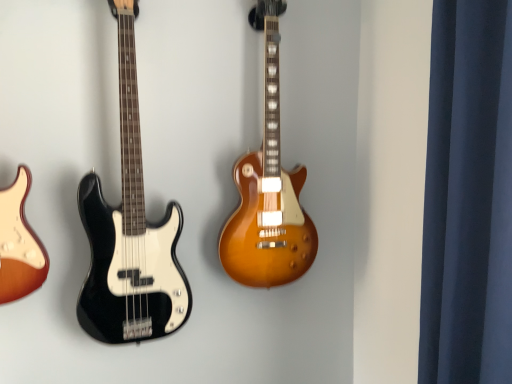
Question: Considering the relative positions of satin sunburst guitar at center, which appears as the 2th guitar when viewed from the left, and dark blue fabric at right in the image provided, is satin sunburst guitar at center, which appears as the 2th guitar when viewed from the left, to the left of dark blue fabric at right from the viewer's perspective?

Choices:
 (A) yes
 (B) no

Answer: (A)

Question: Considering the relative positions of satin sunburst guitar at center, which appears as the 2th guitar when viewed from the left, and dark blue fabric at right in the image provided, is satin sunburst guitar at center, which appears as the 2th guitar when viewed from the left, to the right of dark blue fabric at right from the viewer's perspective?

Choices:
 (A) no
 (B) yes

Answer: (A)

Question: Considering the relative sizes of satin sunburst guitar at center, which is counted as the 1th guitar, starting from the right, and dark blue fabric at right in the image provided, is satin sunburst guitar at center, which is counted as the 1th guitar, starting from the right, thinner than dark blue fabric at right?

Choices:
 (A) no
 (B) yes

Answer: (B)

Question: Considering the relative sizes of satin sunburst guitar at center, which is counted as the 1th guitar, starting from the right, and dark blue fabric at right in the image provided, is satin sunburst guitar at center, which is counted as the 1th guitar, starting from the right, taller than dark blue fabric at right?

Choices:
 (A) yes
 (B) no

Answer: (A)

Question: Is satin sunburst guitar at center, which is counted as the 1th guitar, starting from the right, positioned with its back to dark blue fabric at right?

Choices:
 (A) no
 (B) yes

Answer: (A)

Question: Is satin sunburst guitar at center, which is counted as the 1th guitar, starting from the right, positioned behind dark blue fabric at right?

Choices:
 (A) no
 (B) yes

Answer: (B)

Question: Does satin sunburst guitar at center, which is counted as the 1th guitar, starting from the right, touch black glossy bass guitar at left, which is the 1th guitar from left to right?

Choices:
 (A) yes
 (B) no

Answer: (B)

Question: Is satin sunburst guitar at center, which is counted as the 1th guitar, starting from the right, taller than black glossy bass guitar at left, which is the 1th guitar from left to right?

Choices:
 (A) no
 (B) yes

Answer: (A)

Question: From a real-world perspective, is satin sunburst guitar at center, which is counted as the 1th guitar, starting from the right, below black glossy bass guitar at left, which is the 1th guitar from left to right?

Choices:
 (A) yes
 (B) no

Answer: (B)

Question: From the image's perspective, is satin sunburst guitar at center, which is counted as the 1th guitar, starting from the right, below black glossy bass guitar at left, which is the 1th guitar from left to right?

Choices:
 (A) yes
 (B) no

Answer: (B)

Question: Is satin sunburst guitar at center, which is counted as the 1th guitar, starting from the right, not within black glossy bass guitar at left, which is the 2th guitar in right-to-left order?

Choices:
 (A) no
 (B) yes

Answer: (B)

Question: Considering the relative sizes of satin sunburst guitar at center, which appears as the 2th guitar when viewed from the left, and black glossy bass guitar at left, which is the 2th guitar in right-to-left order, in the image provided, is satin sunburst guitar at center, which appears as the 2th guitar when viewed from the left, thinner than black glossy bass guitar at left, which is the 2th guitar in right-to-left order,?

Choices:
 (A) no
 (B) yes

Answer: (B)

Question: Is dark blue fabric at right positioned in front of black glossy bass guitar at left, which is the 1th guitar from left to right?

Choices:
 (A) no
 (B) yes

Answer: (B)